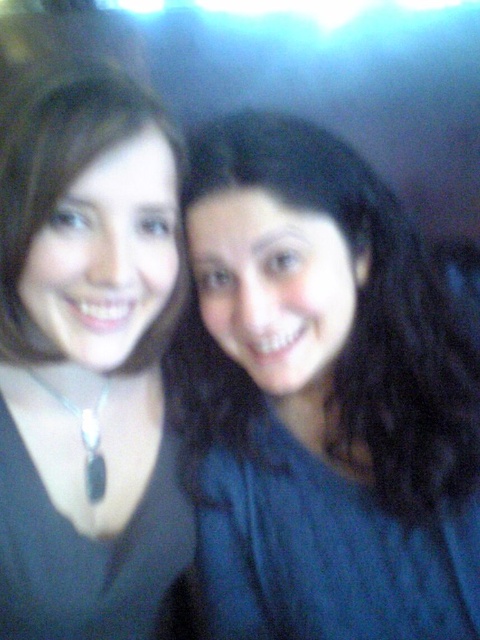
Can you confirm if dark blue sweater at center is positioned to the left of black matte necklace at left?

No, dark blue sweater at center is not to the left of black matte necklace at left.

Does dark blue sweater at center appear over black matte necklace at left?

Yes, dark blue sweater at center is above black matte necklace at left.

In order to click on dark blue sweater at center in this screenshot , I will do `click(324, 397)`.

Who is lower down, dark blue knitted dress at center or black matte necklace at left?

black matte necklace at left is lower down.

Is dark blue knitted dress at center shorter than black matte necklace at left?

Yes.

Does point (222, 532) lie in front of point (132, 524)?

No, it is behind (132, 524).

Identify the location of dark blue knitted dress at center. (325, 550).

Between dark blue sweater at center and black matte necklace at center, which one is positioned lower?

black matte necklace at center is lower down.

Is dark blue sweater at center bigger than black matte necklace at center?

Actually, dark blue sweater at center might be smaller than black matte necklace at center.

Who is more distant from viewer, (305, 355) or (60, 141)?

Positioned behind is point (305, 355).

Image resolution: width=480 pixels, height=640 pixels. What are the coordinates of `dark blue sweater at center` in the screenshot? It's located at (324, 397).